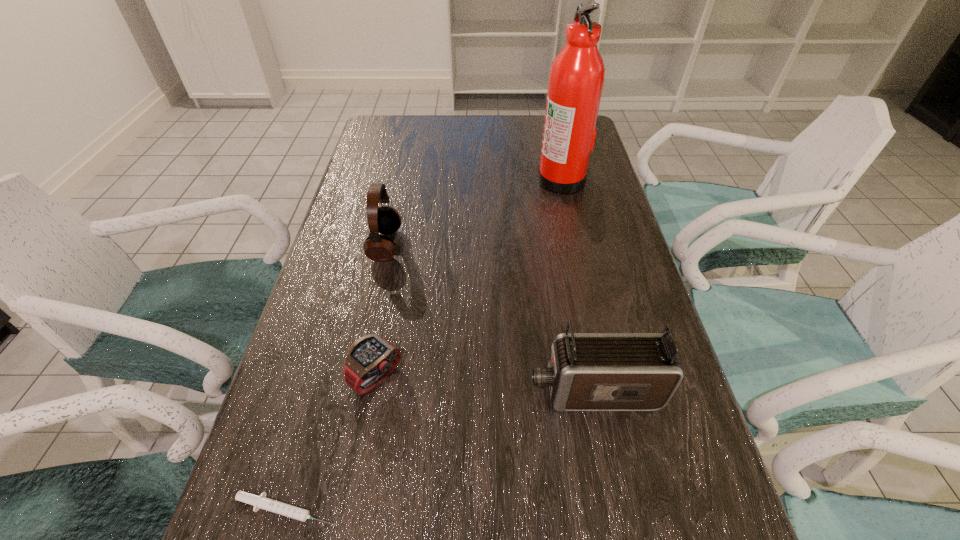
This screenshot has height=540, width=960. In order to click on camcorder located at the right edge in this screenshot , I will do `click(586, 371)`.

Where is `vacant area at the far edge of the desktop`? vacant area at the far edge of the desktop is located at coordinates (445, 148).

Identify the location of free location at the left edge. Image resolution: width=960 pixels, height=540 pixels. (375, 178).

This screenshot has height=540, width=960. What are the coordinates of `free region at the right edge of the desktop` in the screenshot? It's located at (568, 227).

You are a GUI agent. You are given a task and a screenshot of the screen. Output one action in this format:
    pyautogui.click(x=<x>, y=<y>)
    Task: Click on the vacant space at the far left corner of the desktop
    The image size is (960, 540).
    Given the screenshot: What is the action you would take?
    pyautogui.click(x=389, y=146)

The height and width of the screenshot is (540, 960). Find the location of `vacant area that lies between the camcorder and the shortest object`. vacant area that lies between the camcorder and the shortest object is located at coordinates (441, 450).

You are a GUI agent. You are given a task and a screenshot of the screen. Output one action in this format:
    pyautogui.click(x=<x>, y=<y>)
    Task: Click on the free space between the watch and the headset
    The image size is (960, 540).
    Given the screenshot: What is the action you would take?
    pyautogui.click(x=381, y=311)

The width and height of the screenshot is (960, 540). What are the coordinates of `vacant area that lies between the watch and the second farthest object` in the screenshot? It's located at (381, 311).

Where is `free point between the camcorder and the farthest object`? This screenshot has height=540, width=960. free point between the camcorder and the farthest object is located at coordinates (577, 286).

Where is `free spot between the fire extinguisher and the second shortest object`? free spot between the fire extinguisher and the second shortest object is located at coordinates (469, 278).